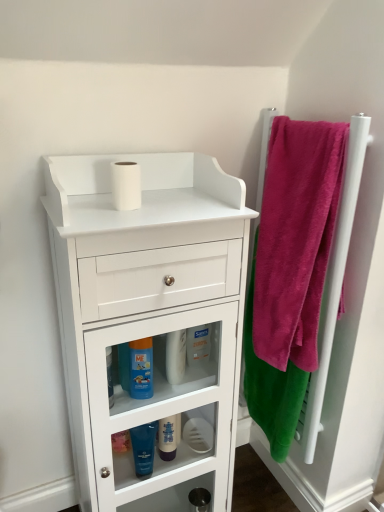
Question: In which direction should I rotate to look at white matte toilet paper at center, which is counted as the 2th toilet paper, starting from the top?

Choices:
 (A) right
 (B) left

Answer: (A)

Question: Does blue glossy mouthwash at lower center, which is the 3th mouthwash in bottom-to-top order, touch white plastic bottle at center?

Choices:
 (A) yes
 (B) no

Answer: (A)

Question: Would you say blue glossy mouthwash at lower center, which is the 3th mouthwash in bottom-to-top order, contains white plastic bottle at center?

Choices:
 (A) yes
 (B) no

Answer: (B)

Question: Is blue glossy mouthwash at lower center, the first mouthwash in the top-to-bottom sequence, not inside white plastic bottle at center?

Choices:
 (A) yes
 (B) no

Answer: (A)

Question: From the image's perspective, is blue glossy mouthwash at lower center, the first mouthwash in the top-to-bottom sequence, above white plastic bottle at center?

Choices:
 (A) no
 (B) yes

Answer: (A)

Question: Is blue glossy mouthwash at lower center, which is the 3th mouthwash in bottom-to-top order, positioned with its back to white plastic bottle at center?

Choices:
 (A) yes
 (B) no

Answer: (B)

Question: Can you confirm if blue glossy mouthwash at lower center, the first mouthwash in the top-to-bottom sequence, is positioned to the left of white plastic bottle at center?

Choices:
 (A) yes
 (B) no

Answer: (A)

Question: Considering the relative sizes of velvet pink towel at right and pink soft towel at right in the image provided, is velvet pink towel at right taller than pink soft towel at right?

Choices:
 (A) yes
 (B) no

Answer: (B)

Question: Is velvet pink towel at right closer to the viewer compared to pink soft towel at right?

Choices:
 (A) no
 (B) yes

Answer: (A)

Question: Does velvet pink towel at right have a lesser height compared to pink soft towel at right?

Choices:
 (A) yes
 (B) no

Answer: (A)

Question: Considering the relative positions of velvet pink towel at right and pink soft towel at right in the image provided, is velvet pink towel at right behind pink soft towel at right?

Choices:
 (A) yes
 (B) no

Answer: (A)

Question: Considering the relative positions of velvet pink towel at right and pink soft towel at right in the image provided, is velvet pink towel at right to the left of pink soft towel at right from the viewer's perspective?

Choices:
 (A) no
 (B) yes

Answer: (B)

Question: Does velvet pink towel at right have a lesser width compared to pink soft towel at right?

Choices:
 (A) yes
 (B) no

Answer: (B)

Question: Could you tell me if velvet pink towel at right is facing white plastic bottle at center?

Choices:
 (A) no
 (B) yes

Answer: (B)